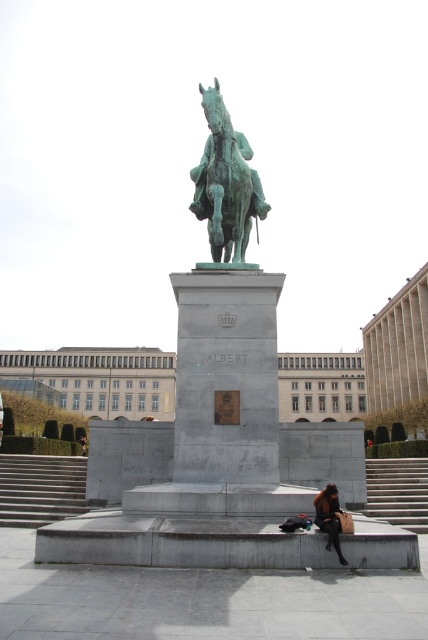
Does gray concrete stairs at lower left have a larger size compared to concrete stairs at lower right?

Indeed, gray concrete stairs at lower left has a larger size compared to concrete stairs at lower right.

Is gray concrete stairs at lower left to the left of concrete stairs at lower right from the viewer's perspective?

Correct, you'll find gray concrete stairs at lower left to the left of concrete stairs at lower right.

What do you see at coordinates (41, 488) in the screenshot? I see `gray concrete stairs at lower left` at bounding box center [41, 488].

The width and height of the screenshot is (428, 640). Identify the location of gray concrete stairs at lower left. (41, 488).

Is the position of concrete stairs at lower right more distant than that of brown leather jacket at lower center?

That is True.

Which of these two, concrete stairs at lower right or brown leather jacket at lower center, stands taller?

Standing taller between the two is concrete stairs at lower right.

Find the location of a particular element. The image size is (428, 640). concrete stairs at lower right is located at coordinates (398, 492).

Find the location of `concrete stairs at lower right`. concrete stairs at lower right is located at coordinates (398, 492).

Does green patina statue at center have a smaller size compared to concrete stairs at lower right?

Indeed, green patina statue at center has a smaller size compared to concrete stairs at lower right.

Does green patina statue at center appear under concrete stairs at lower right?

No, green patina statue at center is not below concrete stairs at lower right.

Measure the distance between point (x=244, y=154) and camera.

Point (x=244, y=154) and camera are 48.20 feet apart from each other.

Locate an element on the screen. This screenshot has height=640, width=428. green patina statue at center is located at coordinates (225, 182).